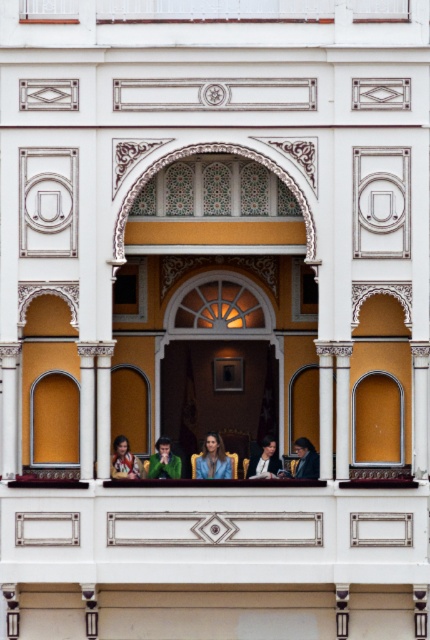
You are a delivery person trying to place a large package on the balcony. The package is 1.2 meters wide. You see the green velvet chair at center and the matte black jacket at center. Can you determine if the package will fit between them?

The green velvet chair at center might be wider than matte black jacket at center, so it is uncertain if the package will fit between them. You should measure the space first before placing the package.

You are a tailor observing two suits displayed on the balcony. The dark blue suit at lower right and the matte black suit at center. Which suit has a narrower width?

The dark blue suit at lower right is thinner than the matte black suit at center, so the dark blue suit at lower right has a narrower width.